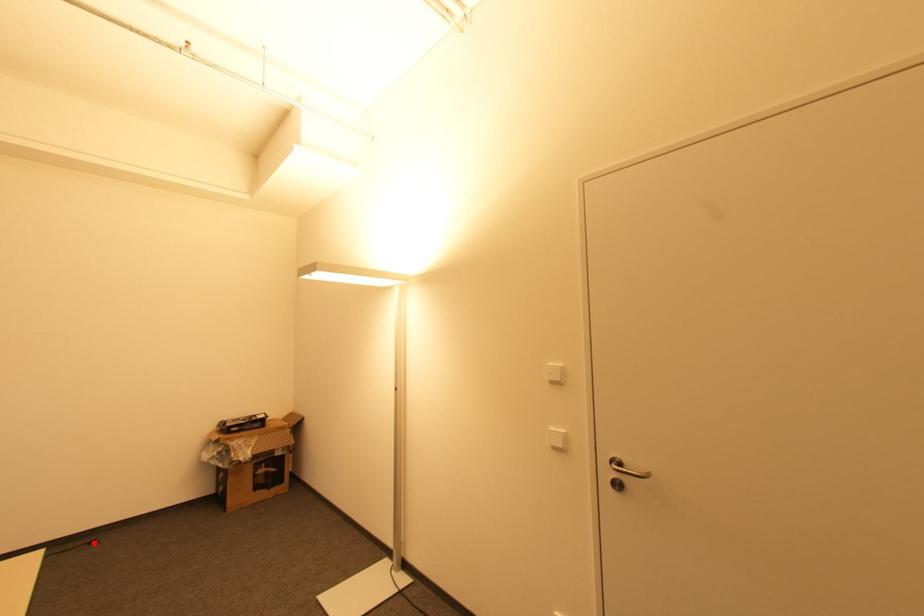
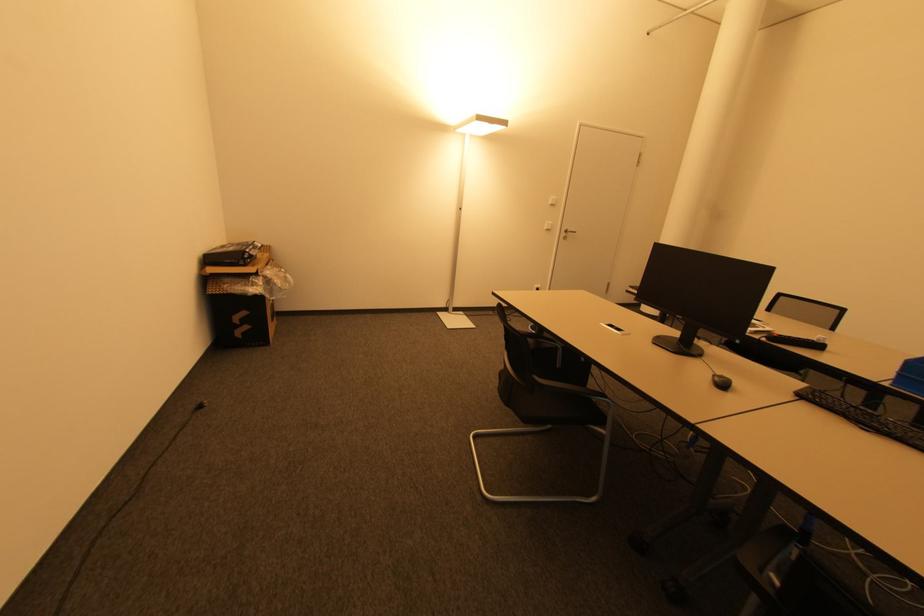
Question: I am providing you with two images of the same scene from different viewpoints. Image1 has a red point marked. In image2, the corresponding 3D location appears at what relative position? Reply with the corresponding letter.

Choices:
 (A) Closer
 (B) Farther

Answer: (A)